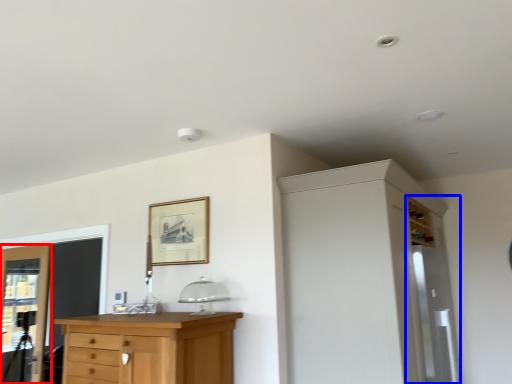
Question: Which object is further to the camera taking this photo, door (highlighted by a red box) or screen door (highlighted by a blue box)?

Choices:
 (A) door
 (B) screen door

Answer: (A)